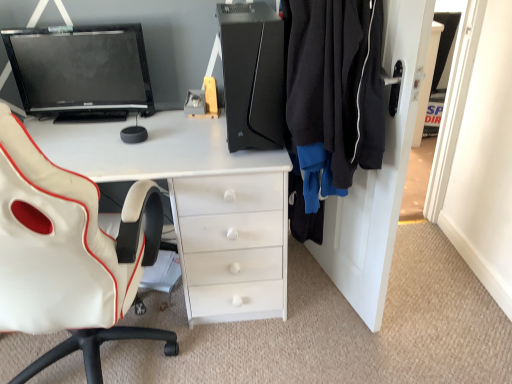
You are a GUI agent. You are given a task and a screenshot of the screen. Output one action in this format:
    pyautogui.click(x=<x>, y=<y>)
    Task: Click on the vacant space underneath matte black monitor at upper left (from a real-world perspective)
    
    Given the screenshot: What is the action you would take?
    pyautogui.click(x=101, y=119)